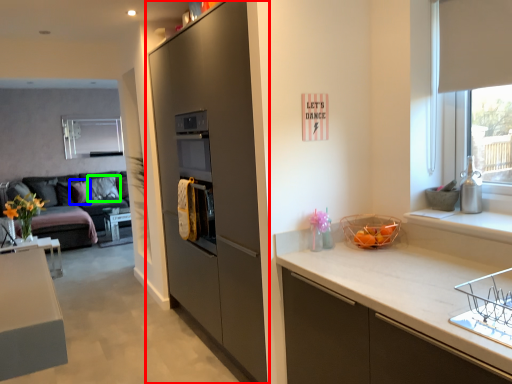
Question: Which object is positioned farthest from cabinetry (highlighted by a red box)? Select from pillow (highlighted by a blue box) and pillow (highlighted by a green box).

Choices:
 (A) pillow
 (B) pillow

Answer: (A)